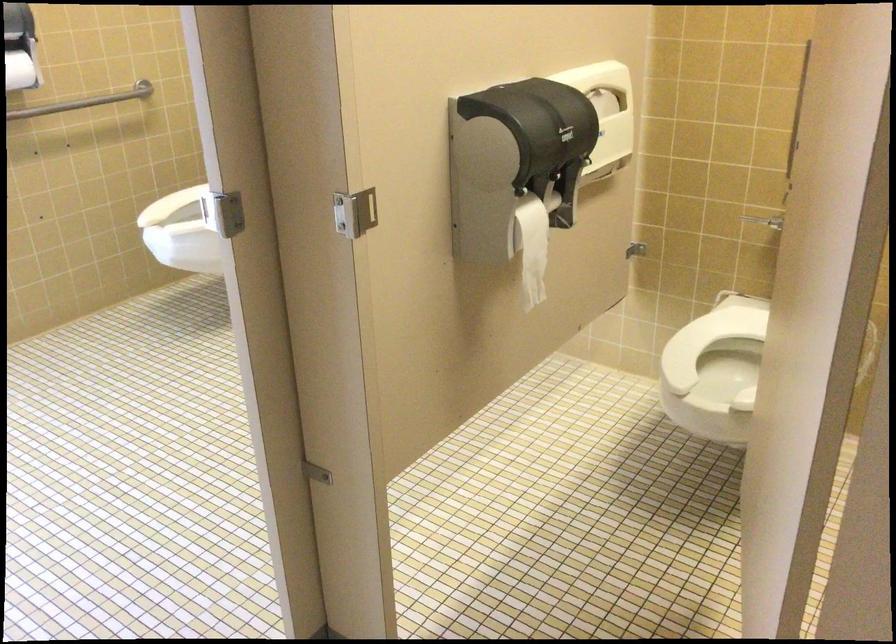
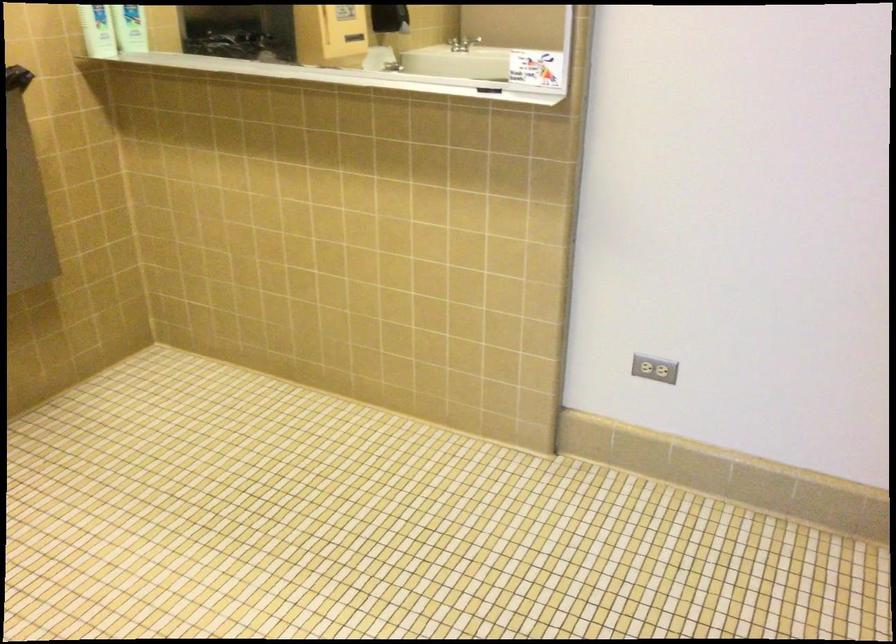
Based on the continuous images, in which direction is the camera rotating?

The camera rotated toward right-down.